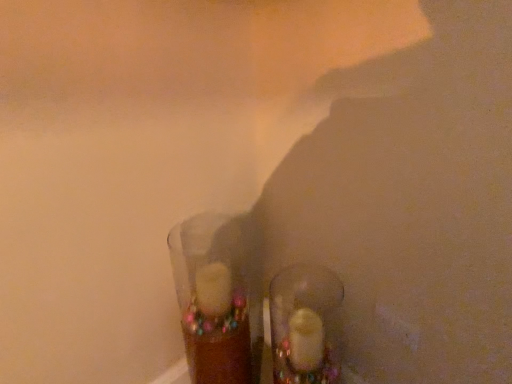
Question: Does translucent glass candle at center appear on the left side of translucent glass shoe at center?

Choices:
 (A) yes
 (B) no

Answer: (A)

Question: Could you tell me if translucent glass candle at center is facing translucent glass shoe at center?

Choices:
 (A) no
 (B) yes

Answer: (A)

Question: From the image's perspective, would you say translucent glass candle at center is shown under translucent glass shoe at center?

Choices:
 (A) yes
 (B) no

Answer: (B)

Question: Is translucent glass candle at center shorter than translucent glass shoe at center?

Choices:
 (A) no
 (B) yes

Answer: (A)

Question: Is translucent glass candle at center thinner than translucent glass shoe at center?

Choices:
 (A) yes
 (B) no

Answer: (B)

Question: Is translucent glass candle at center positioned in front of translucent glass shoe at center?

Choices:
 (A) yes
 (B) no

Answer: (A)

Question: Does translucent glass shoe at center have a greater height compared to translucent glass candle at center?

Choices:
 (A) yes
 (B) no

Answer: (B)

Question: Is translucent glass shoe at center directly adjacent to translucent glass candle at center?

Choices:
 (A) yes
 (B) no

Answer: (B)

Question: Can you confirm if translucent glass shoe at center is thinner than translucent glass candle at center?

Choices:
 (A) no
 (B) yes

Answer: (B)

Question: Considering the relative positions of translucent glass shoe at center and translucent glass candle at center in the image provided, is translucent glass shoe at center in front of translucent glass candle at center?

Choices:
 (A) no
 (B) yes

Answer: (A)

Question: Considering the relative sizes of translucent glass shoe at center and translucent glass candle at center in the image provided, is translucent glass shoe at center shorter than translucent glass candle at center?

Choices:
 (A) yes
 (B) no

Answer: (A)

Question: From the image's perspective, is translucent glass shoe at center under translucent glass candle at center?

Choices:
 (A) yes
 (B) no

Answer: (A)

Question: From the image's perspective, is translucent glass shoe at center above or below translucent glass candle at center?

Choices:
 (A) below
 (B) above

Answer: (A)